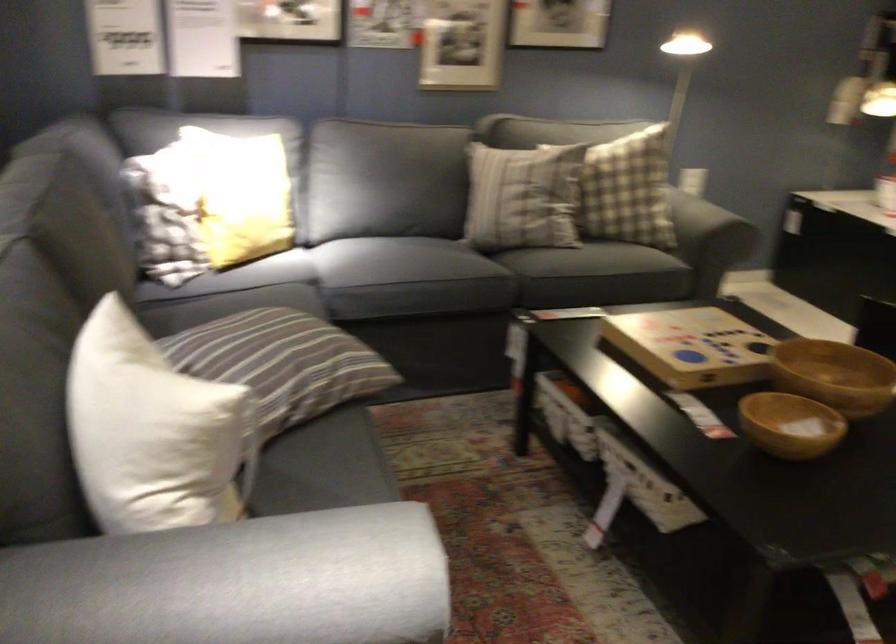
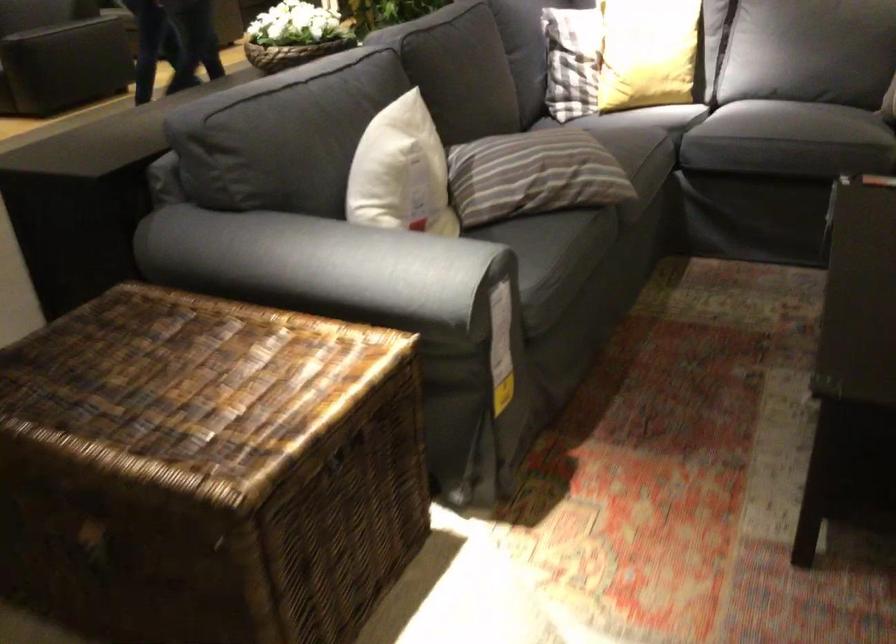
Locate, in the second image, the point that corresponds to the point at 109,574 in the first image.

(304, 265)